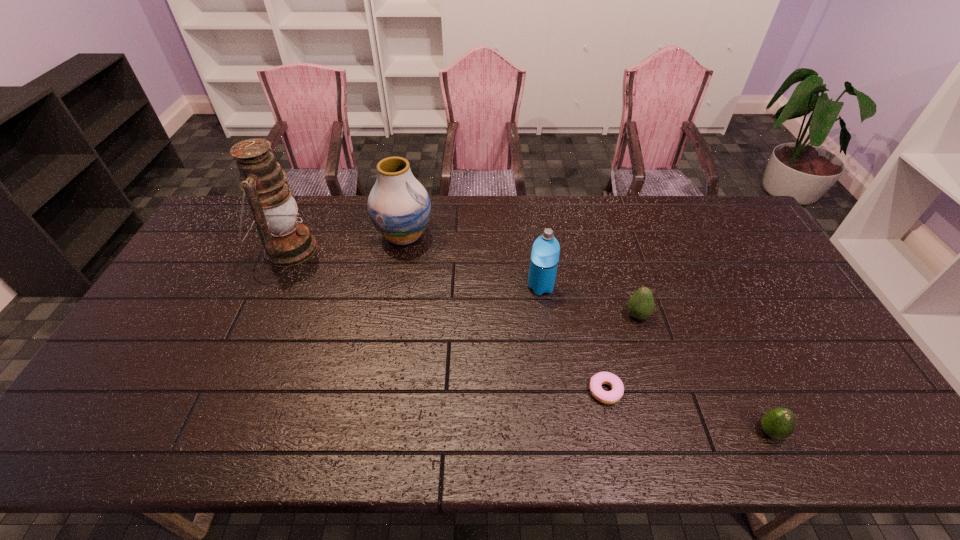
Where is `doughnut`? This screenshot has width=960, height=540. doughnut is located at coordinates (608, 397).

This screenshot has height=540, width=960. What are the coordinates of `the second nearest object` in the screenshot? It's located at (608, 397).

Find the location of a particular element. This screenshot has height=540, width=960. free point located 0.180m on the back of the lantern is located at coordinates (313, 195).

Find the location of `free location located 0.130m on the left of the fifth shortest object`. free location located 0.130m on the left of the fifth shortest object is located at coordinates (x=337, y=236).

Find the location of a particular element. vacant area situated 0.390m on the left of the third object from left to right is located at coordinates (399, 287).

Where is `free region located on the left of the left avocado`? The height and width of the screenshot is (540, 960). free region located on the left of the left avocado is located at coordinates (516, 315).

Find the location of `vacant space situated 0.050m on the right of the nearer avocado`. vacant space situated 0.050m on the right of the nearer avocado is located at coordinates (805, 432).

Locate an element on the screen. Image resolution: width=960 pixels, height=540 pixels. free space located on the left of the doughnut is located at coordinates (485, 391).

This screenshot has height=540, width=960. I want to click on lantern that is at the far edge, so click(286, 243).

In order to click on vase located in the far edge section of the desktop in this screenshot , I will do `click(399, 207)`.